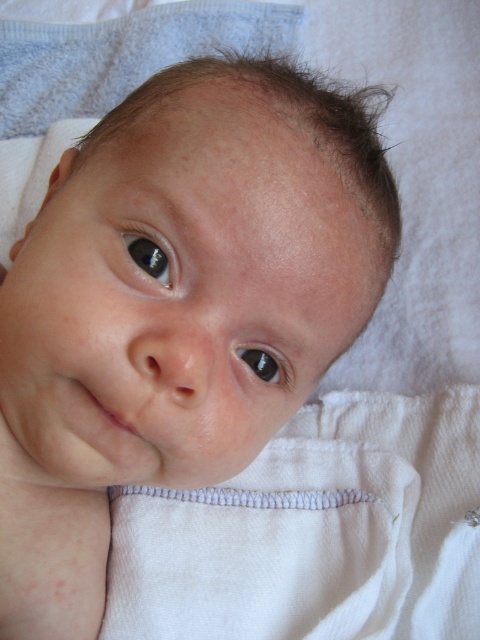
Can you confirm if black glossy eye at upper left is smaller than black glossy eye at center?

Yes.

Between black glossy eye at upper left and black glossy eye at center, which one appears on the right side from the viewer's perspective?

From the viewer's perspective, black glossy eye at center appears more on the right side.

Where is `black glossy eye at upper left`? The height and width of the screenshot is (640, 480). black glossy eye at upper left is located at coordinates 148,257.